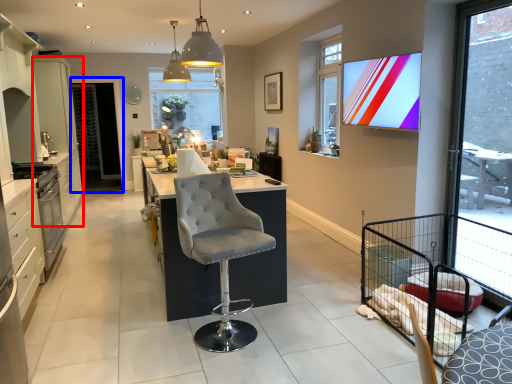
Question: Which object is closer to the camera taking this photo, cabinetry (highlighted by a red box) or screen door (highlighted by a blue box)?

Choices:
 (A) cabinetry
 (B) screen door

Answer: (A)